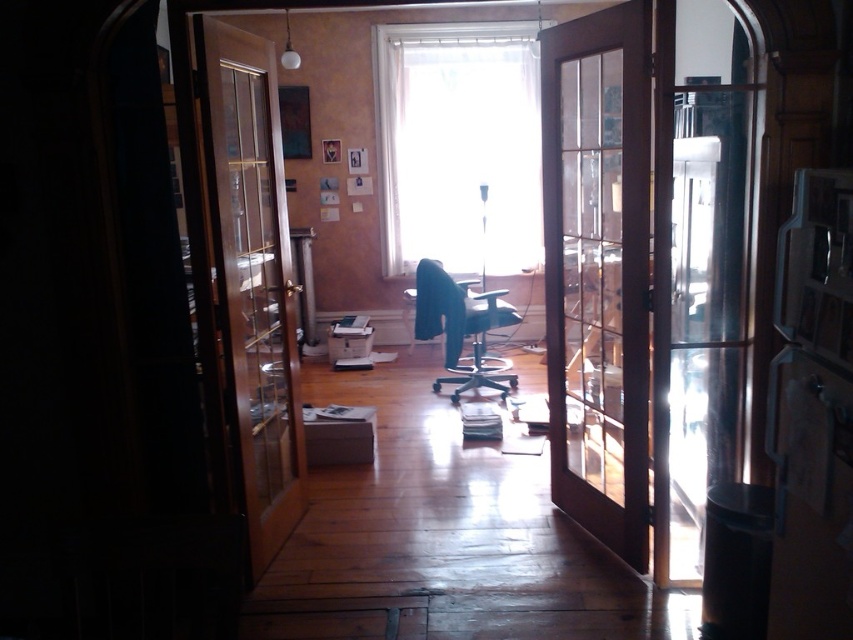
Question: Which point is farther to the camera?

Choices:
 (A) (693, 506)
 (B) (451, 365)
 (C) (248, 76)

Answer: (B)

Question: Based on their relative distances, which object is farther from the brown wooden screen door at center?

Choices:
 (A) wooden door at left
 (B) matte black swivel chair at center
 (C) satin silver refrigerator at right

Answer: (B)

Question: Is satin silver refrigerator at right closer to camera compared to matte black swivel chair at center?

Choices:
 (A) yes
 (B) no

Answer: (A)

Question: Among these points, which one is nearest to the camera?

Choices:
 (A) (260, 38)
 (B) (491, 314)
 (C) (680, 584)

Answer: (C)

Question: Can you confirm if brown wooden screen door at center is smaller than satin silver refrigerator at right?

Choices:
 (A) no
 (B) yes

Answer: (A)

Question: Is wooden door at left bigger than matte black swivel chair at center?

Choices:
 (A) no
 (B) yes

Answer: (A)